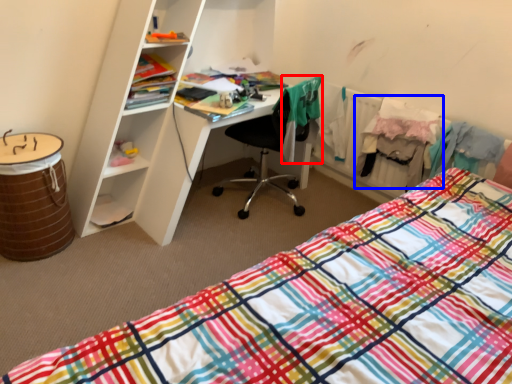
Question: Which point is closer to the camera, clothing (highlighted by a red box) or clothing (highlighted by a blue box)?

Choices:
 (A) clothing
 (B) clothing

Answer: (A)